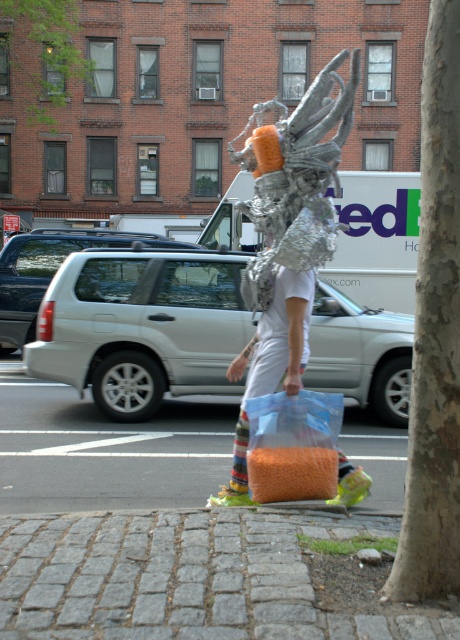
Can you confirm if brown rough bark tree at right is thinner than translucent plastic bag at center?

Yes, brown rough bark tree at right is thinner than translucent plastic bag at center.

Which is above, brown rough bark tree at right or translucent plastic bag at center?

Positioned higher is translucent plastic bag at center.

This screenshot has height=640, width=460. I want to click on brown rough bark tree at right, so click(x=435, y=333).

Is point (249, 483) positioned in front of point (302, 164)?

No, it is behind (302, 164).

This screenshot has width=460, height=640. In order to click on translucent plastic bag at center in this screenshot , I will do (x=293, y=445).

In the scene shown: Between brown rough bark tree at right and shiny metallic mask at center, which one appears on the right side from the viewer's perspective?

From the viewer's perspective, brown rough bark tree at right appears more on the right side.

Is brown rough bark tree at right above shiny metallic mask at center?

No.

In order to click on brown rough bark tree at right in this screenshot , I will do `click(435, 333)`.

Locate an element on the screen. brown rough bark tree at right is located at coordinates (435, 333).